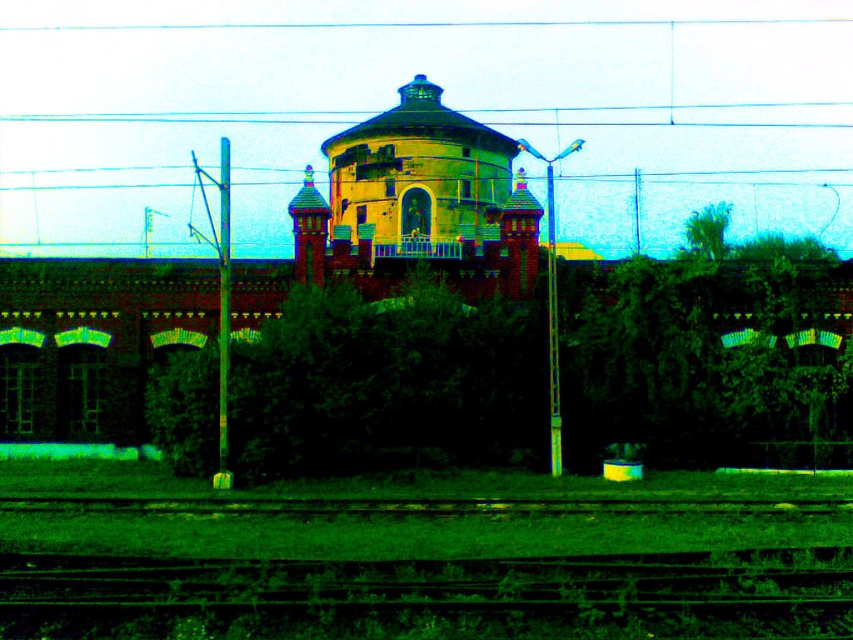
You are a landscape architect planning to install a new pathway. You need to know which object between the green grassy train track at lower center and the yellow brick water tower at center takes up more space. Which one is larger?

The yellow brick water tower at center is larger than the green grassy train track at lower center.